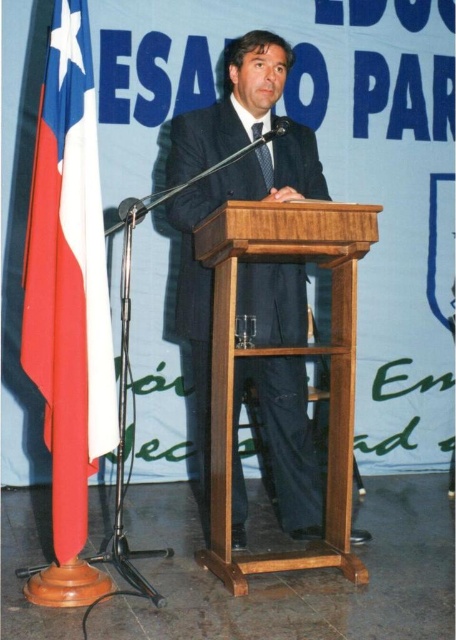
You are taking a photo of the speaker at the podium and want to focus on two specific points in the scene. The first point is at coordinate point(30, 333) and the second is at point(270, 168). Which point is closer to the camera?

Point(30, 333) is closer to the camera than point(270, 168).

You are an event organizer who needs to adjust the microphone position for better sound quality. The microphone is currently on the left side of the podium. Considering the proximity of the red fabric flag at left and the black silk tie at center, which object is closer to the microphone and should be considered during adjustments?

The red fabric flag at left is closer to the viewer than the black silk tie at center, so the red fabric flag at left is closer to the microphone. When adjusting the microphone position, ensure it is angled away from the flag to prevent interference with the sound quality.